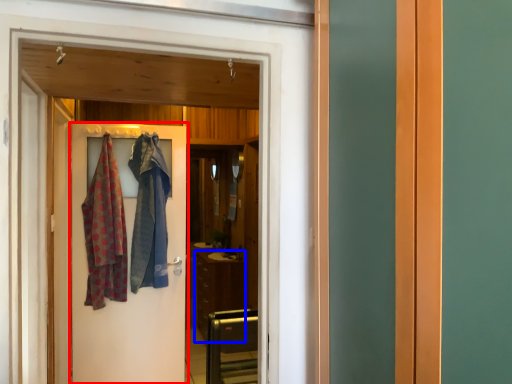
Question: Which object is closer to the camera taking this photo, door (highlighted by a red box) or cabinetry (highlighted by a blue box)?

Choices:
 (A) door
 (B) cabinetry

Answer: (A)